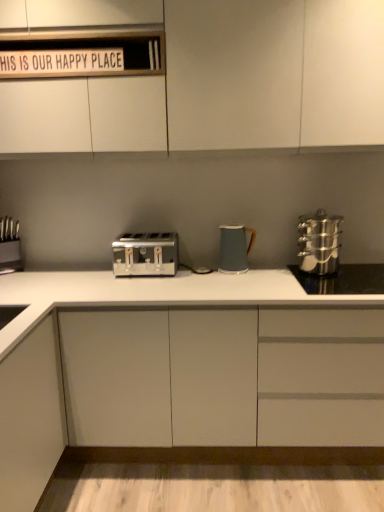
Question: Is satin silver toaster at center oriented away from white wood sign at upper center?

Choices:
 (A) no
 (B) yes

Answer: (A)

Question: From a real-world perspective, is satin silver toaster at center under white wood sign at upper center?

Choices:
 (A) yes
 (B) no

Answer: (A)

Question: From the image's perspective, is satin silver toaster at center located above white wood sign at upper center?

Choices:
 (A) yes
 (B) no

Answer: (B)

Question: Considering the relative sizes of satin silver toaster at center and white wood sign at upper center in the image provided, is satin silver toaster at center taller than white wood sign at upper center?

Choices:
 (A) no
 (B) yes

Answer: (B)

Question: Is satin silver toaster at center positioned in front of white wood sign at upper center?

Choices:
 (A) no
 (B) yes

Answer: (A)

Question: Can you confirm if satin silver toaster at center is shorter than white wood sign at upper center?

Choices:
 (A) yes
 (B) no

Answer: (B)

Question: Considering the relative sizes of white matte cabinet at upper center, which appears as the second cabinetry when ordered from the bottom, and stainless steel knife block at left in the image provided, is white matte cabinet at upper center, which appears as the second cabinetry when ordered from the bottom, shorter than stainless steel knife block at left?

Choices:
 (A) no
 (B) yes

Answer: (A)

Question: From a real-world perspective, is white matte cabinet at upper center, which appears as the second cabinetry when ordered from the bottom, positioned over stainless steel knife block at left based on gravity?

Choices:
 (A) yes
 (B) no

Answer: (A)

Question: Is white matte cabinet at upper center, which appears as the second cabinetry when ordered from the bottom, to the left of stainless steel knife block at left from the viewer's perspective?

Choices:
 (A) yes
 (B) no

Answer: (B)

Question: Can you confirm if white matte cabinet at upper center, which appears as the second cabinetry when ordered from the bottom, is wider than stainless steel knife block at left?

Choices:
 (A) yes
 (B) no

Answer: (A)

Question: From a real-world perspective, is white matte cabinet at upper center, which appears as the second cabinetry when ordered from the bottom, physically below stainless steel knife block at left?

Choices:
 (A) yes
 (B) no

Answer: (B)

Question: Is white matte cabinet at upper center, the first cabinetry positioned from the top, not near stainless steel knife block at left?

Choices:
 (A) no
 (B) yes

Answer: (B)

Question: From a real-world perspective, is stainless steel steamer at right beneath satin silver toaster at center?

Choices:
 (A) yes
 (B) no

Answer: (B)